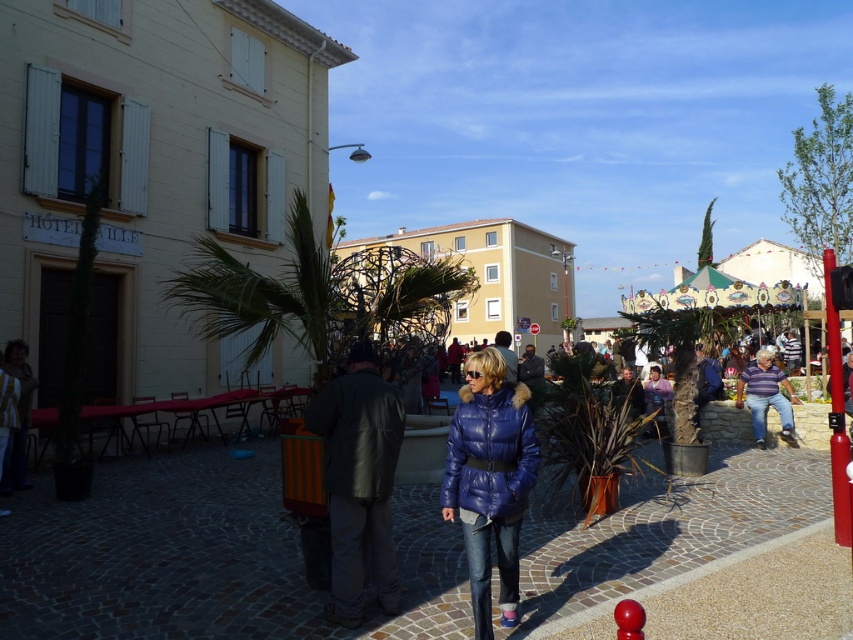
Does dark gray leather jacket at center appear over blue down jacket at center?

No, dark gray leather jacket at center is not above blue down jacket at center.

Is the position of dark gray leather jacket at center less distant than that of blue down jacket at center?

No, it is behind blue down jacket at center.

Identify the location of dark gray leather jacket at center. (358, 483).

Identify the location of dark gray leather jacket at center. (358, 483).

Measure the distance from blue down jacket at center to striped cotton shirt at center.

The distance of blue down jacket at center from striped cotton shirt at center is 8.26 meters.

Is blue down jacket at center shorter than striped cotton shirt at center?

No, blue down jacket at center is not shorter than striped cotton shirt at center.

Who is more distant from viewer, (489, 602) or (787, 429)?

Point (787, 429)

This screenshot has width=853, height=640. Find the location of `blue down jacket at center`. blue down jacket at center is located at coordinates (490, 481).

Identify the location of dark gray leather jacket at center. (358, 483).

Which is more to the left, dark gray leather jacket at center or striped cotton shirt at center?

dark gray leather jacket at center

Which is behind, point (347, 353) or point (758, 380)?

The point (758, 380) is behind.

The image size is (853, 640). I want to click on dark gray leather jacket at center, so click(x=358, y=483).